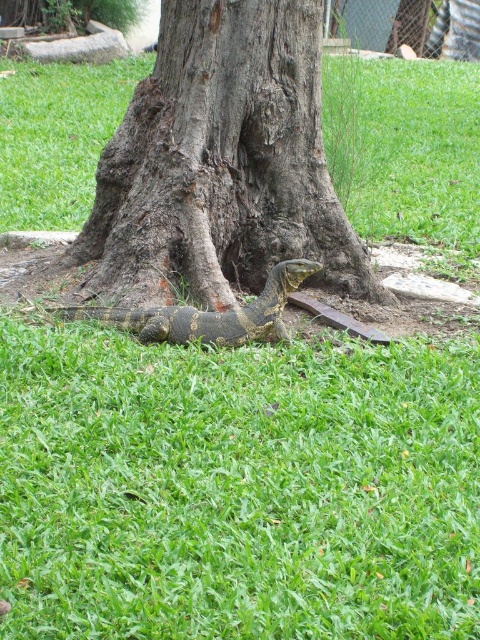
In the scene shown: You are standing at the origin point in the image, which is the bottom left corner. The brown rough bark tree at center is at coordinates approximately 0.258 in the x and 0.460 in the y direction. If you want to walk directly towards the tree, which direction should you move in terms of left, right, forward, or backward?

Since the brown rough bark tree at center is located at coordinates x 0.258 and y 0.460, and you are at the origin, you should move forward and to the right to reach it. The x coordinate indicates horizontal position, so a higher x means to the right, and the y coordinate indicates vertical position, so a lower y means moving forward. Therefore, moving forward and slightly right would align you with the tree.

You are a photographer setting up a tripod to capture the monitor lizard. You have two points marked on your viewfinder at coordinates point (300, 8) and point (176, 316). Which point is closer to the camera?

Point (176, 316) is closer to the camera because it is less further than point (300, 8) according to the description.